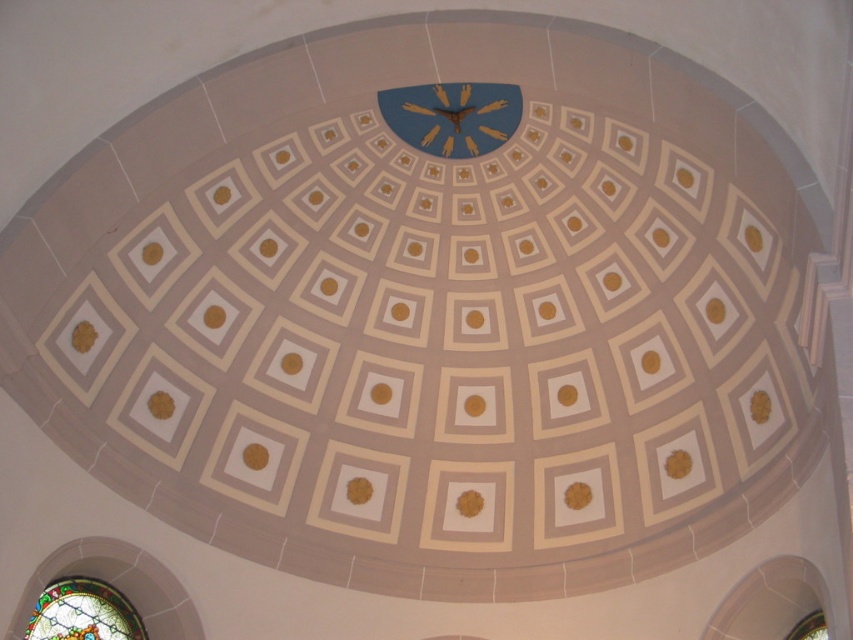
You are standing directly below the dome ceiling and want to locate the blue matte clock at center. According to the coordinates provided, where should you look relative to the center of the dome?

The blue matte clock at center is located at point coordinates 0.183 on the x and 0.531 on the y. This means it is slightly to the left and below the center of the dome.

You are an architect examining the dome ceiling. You notice two points marked on the ceiling at coordinates point (485, 115) and point (140, 628). Which point is closer to you as you stand directly below the dome?

Point (485, 115) is further to the viewer than point (140, 628), so the point closer to you would be point (140, 628).

You are an architect designing a new dome ceiling. You need to place a decorative element that must be wider than the stained glass window at lower left. Can the blue matte clock at center accommodate this requirement?

The blue matte clock at center might be wider than stained glass window at lower left, so it could potentially accommodate the requirement depending on the exact measurements.